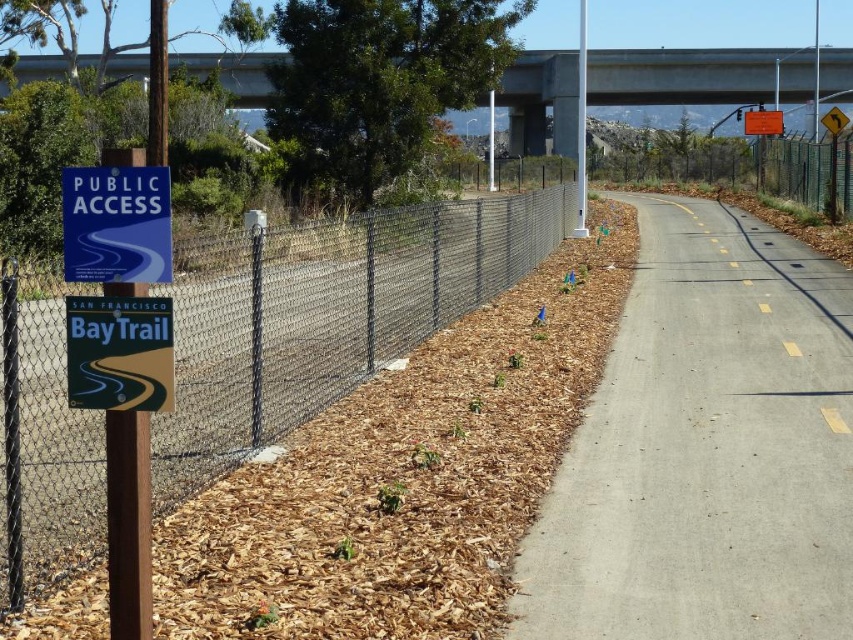
How distant is concrete at upper center from blue plastic sign at left?

concrete at upper center and blue plastic sign at left are 65.05 meters apart.

Does concrete at upper center lie behind blue plastic sign at left?

Yes, it is behind blue plastic sign at left.

The width and height of the screenshot is (853, 640). Identify the location of concrete at upper center. (698, 76).

The height and width of the screenshot is (640, 853). I want to click on concrete at upper center, so click(x=698, y=76).

Is point (757, 598) closer to camera compared to point (160, 276)?

No.

Does gray asphalt road at center have a lesser height compared to blue plastic sign at left?

In fact, gray asphalt road at center may be taller than blue plastic sign at left.

Is point (579, 433) behind point (126, 240)?

That is True.

Locate an element on the screen. gray asphalt road at center is located at coordinates (706, 449).

Is green plastic sign at left wider than green chain-link fence at upper right?

No, green plastic sign at left is not wider than green chain-link fence at upper right.

Which is above, green plastic sign at left or green chain-link fence at upper right?

green chain-link fence at upper right is higher up.

At what (x,y) coordinates should I click in order to perform the action: click on green plastic sign at left. Please return your answer as a coordinate pair (x, y). The height and width of the screenshot is (640, 853). Looking at the image, I should click on (119, 353).